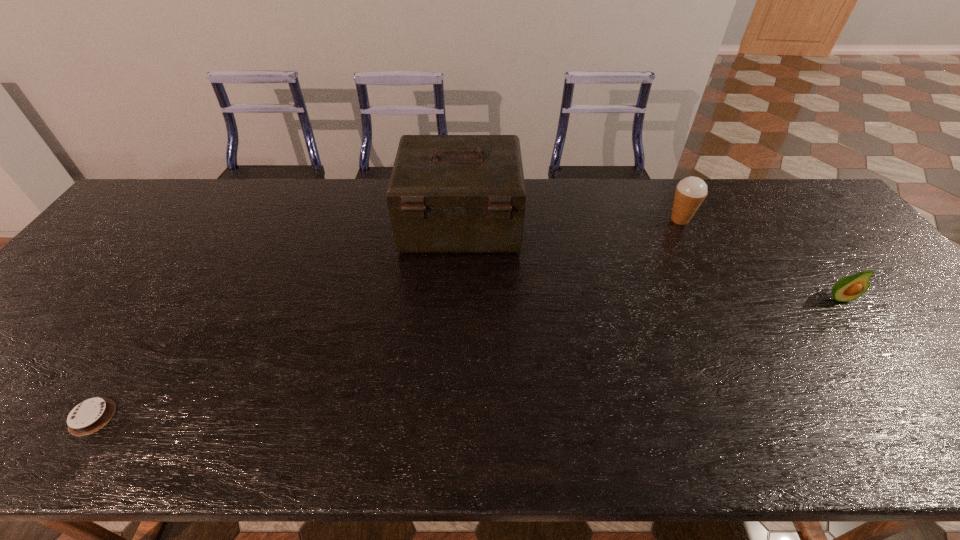
Image resolution: width=960 pixels, height=540 pixels. What are the coordinates of `the third object from right to left` in the screenshot? It's located at (447, 193).

Find the location of a particular element. This screenshot has width=960, height=540. the first-aid kit is located at coordinates (447, 193).

The height and width of the screenshot is (540, 960). In order to click on the third object from left to right in this screenshot , I will do `click(690, 192)`.

The width and height of the screenshot is (960, 540). Find the location of `icecream`. icecream is located at coordinates (690, 192).

Identify the location of the rightmost object. The image size is (960, 540). (849, 288).

Locate an element on the screen. the third tallest object is located at coordinates (849, 288).

Identify the location of the shortest object. The width and height of the screenshot is (960, 540). (89, 416).

At what (x,y) coordinates should I click in order to perform the action: click on the nearest object. Please return your answer as a coordinate pair (x, y). The image size is (960, 540). Looking at the image, I should click on (89, 416).

This screenshot has height=540, width=960. I want to click on vacant space situated 0.070m on the left of the tallest object, so click(x=380, y=224).

Locate an element on the screen. vacant space situated on the front of the icecream is located at coordinates (727, 313).